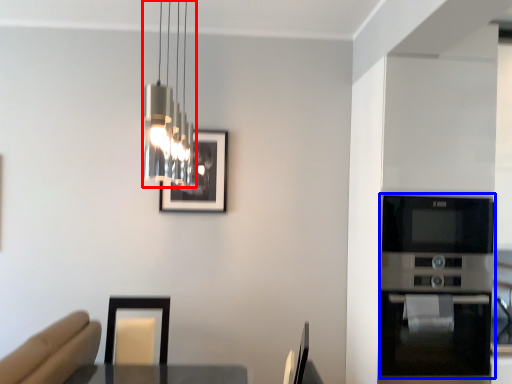
Question: Which object appears farthest to the camera in this image, lamp (highlighted by a red box) or appliance (highlighted by a blue box)?

Choices:
 (A) lamp
 (B) appliance

Answer: (B)